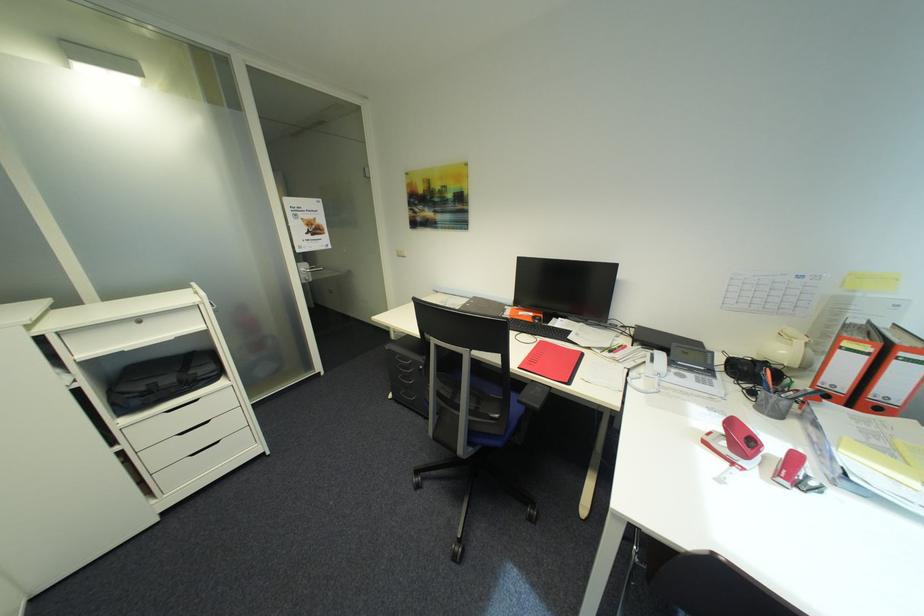
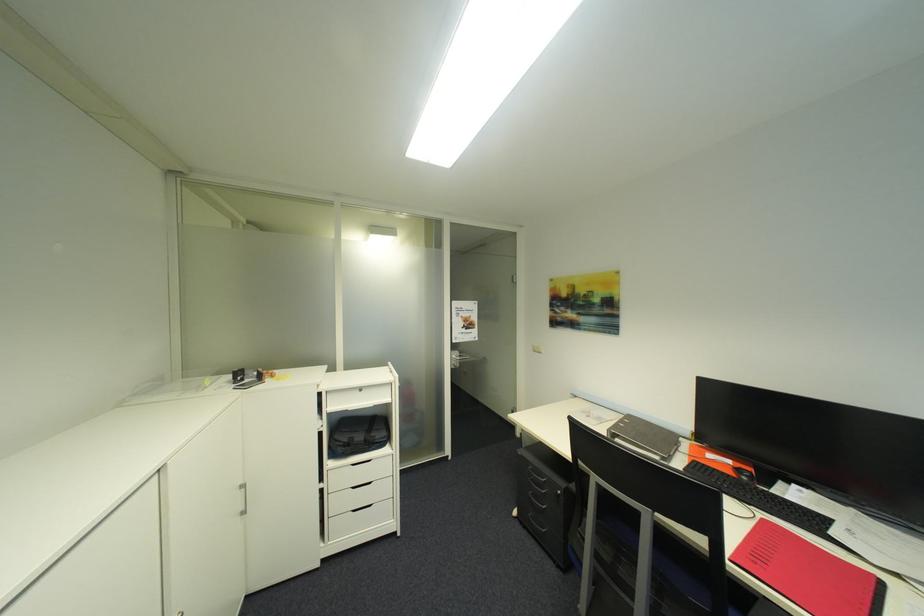
The first image is from the beginning of the video and the second image is from the end. How did the camera likely rotate when shooting the video?

The camera's rotation is toward left-up.